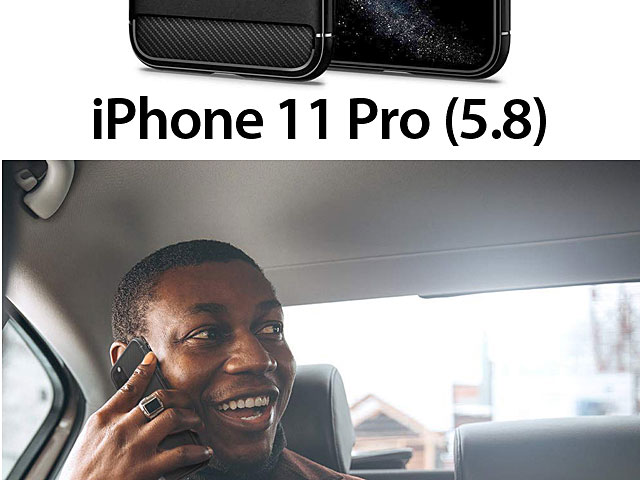
The width and height of the screenshot is (640, 480). I want to click on headrest, so click(308, 417).